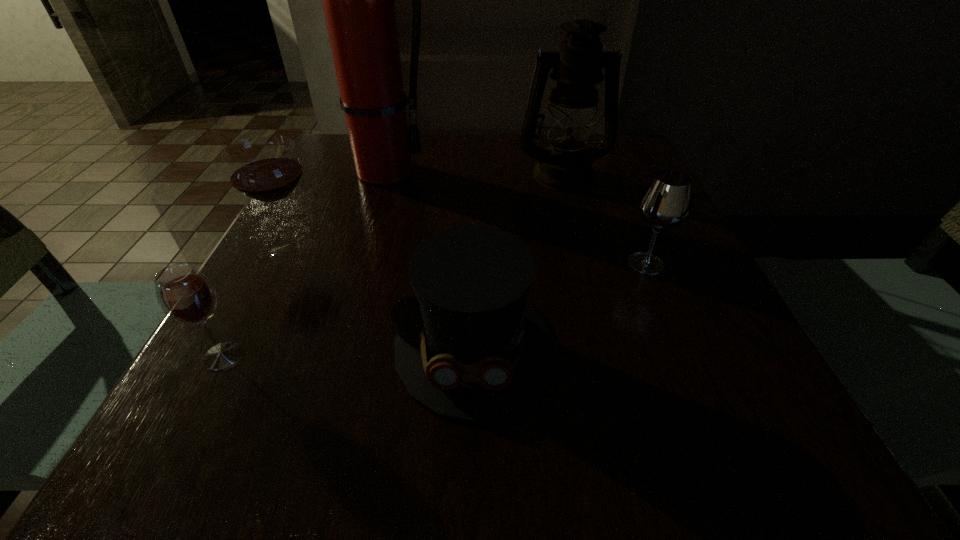
Point out which object is positioned as the fifth nearest to the rightmost wineglass. Please provide its 2D coordinates. Your answer should be formatted as a tuple, i.e. [(x, y)], where the tuple contains the x and y coordinates of a point satisfying the conditions above.

[(185, 295)]

Where is `the fourth closest object to the nearest wineglass`? This screenshot has width=960, height=540. the fourth closest object to the nearest wineglass is located at coordinates (577, 66).

Locate an element on the screen. This screenshot has width=960, height=540. the closest wineglass relative to the rightmost wineglass is located at coordinates (265, 168).

Where is `wineglass object that ranks as the third closest to the dress hat`? Image resolution: width=960 pixels, height=540 pixels. wineglass object that ranks as the third closest to the dress hat is located at coordinates (185, 295).

Locate an element on the screen. The height and width of the screenshot is (540, 960). vacant position in the image that satisfies the following two spatial constraints: 1. on the hose direction of the tallest object; 2. on the left side of the second tallest object is located at coordinates 382,174.

Image resolution: width=960 pixels, height=540 pixels. I want to click on vacant space that satisfies the following two spatial constraints: 1. on the hose direction of the rightmost wineglass; 2. on the left side of the fire extinguisher, so click(352, 264).

The height and width of the screenshot is (540, 960). Find the location of `free space that satisfies the following two spatial constraints: 1. on the hose direction of the rightmost wineglass; 2. on the right side of the fire extinguisher`. free space that satisfies the following two spatial constraints: 1. on the hose direction of the rightmost wineglass; 2. on the right side of the fire extinguisher is located at coordinates (352, 264).

Find the location of a particular element. The image size is (960, 540). free space that satisfies the following two spatial constraints: 1. on the hose direction of the fire extinguisher; 2. on the right side of the oil lamp is located at coordinates (382, 174).